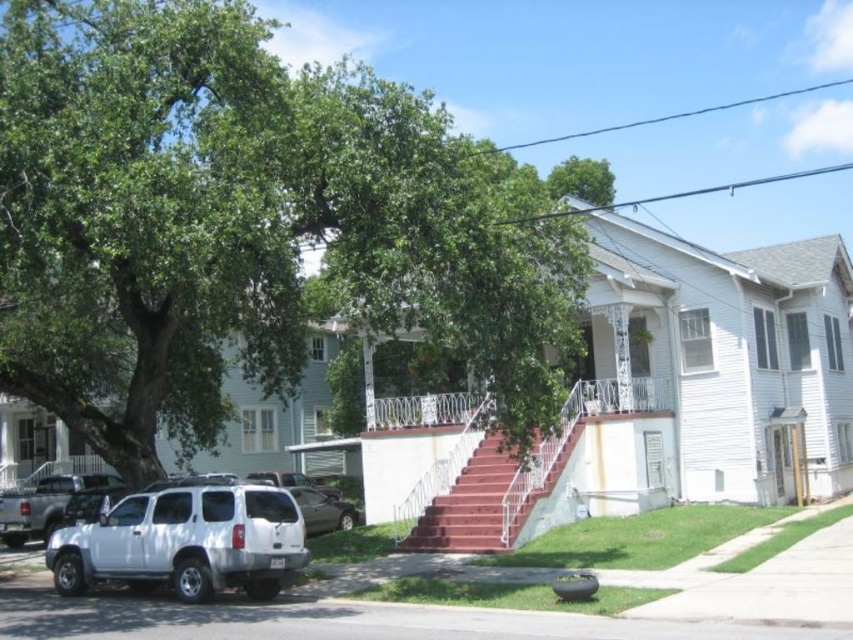
You are a delivery person trying to park your van in front of the house with the white SUV. There is a metallic gray sedan at lower center blocking the path. Can you drive around the green leafy tree at upper left to reach the parking spot?

The green leafy tree at upper left is positioned on the left side of the metallic gray sedan at lower center. Since the tree is to the left of the sedan, you can drive around the green leafy tree at upper left to go around the metallic gray sedan at lower center and reach the parking spot.

Based on the photo, you are standing at the front of the light blue house with the white picket fence. You see a point at coordinates (x=186, y=541). Which object is this point located on?

The point at coordinates (x=186, y=541) is located on the white matte SUV at lower left.